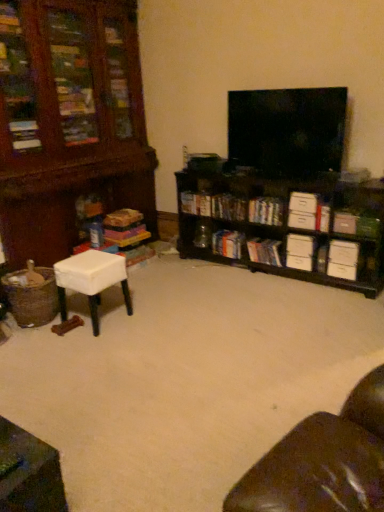
At what (x,y) coordinates should I click in order to perform the action: click on space that is in front of white fabric stool at lower left, which ranks as the 1th table in top-to-bottom order. Please return your answer as a coordinate pair (x, y). This screenshot has width=384, height=512. Looking at the image, I should click on (85, 345).